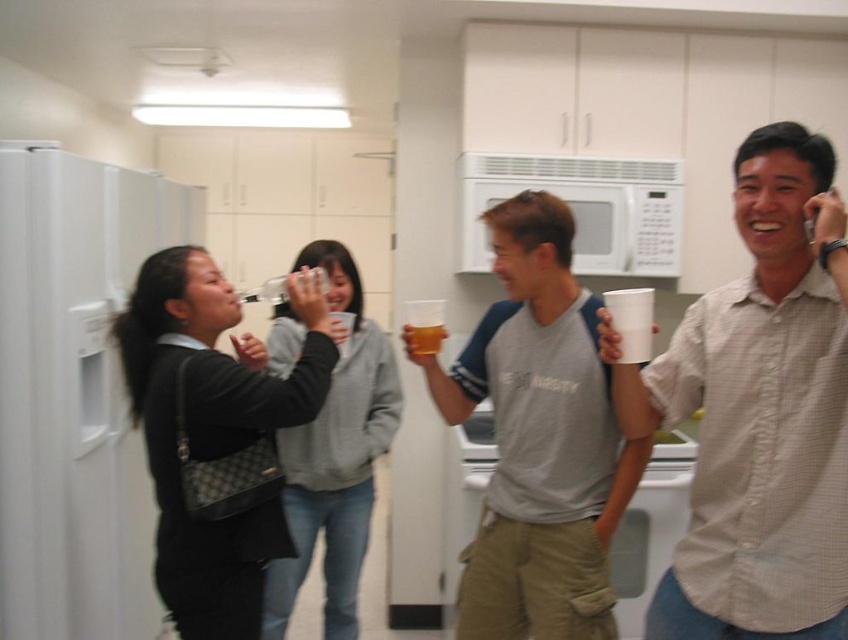
You are a photographer trying to capture a group photo of the people in the scene. You notice two individuals wearing the white shirt at right and the matte gray hoodie at center. Since you want to ensure both are fully visible in the frame, which clothing item should you adjust your camera angle to focus on first?

The white shirt at right is not as tall as the matte gray hoodie at center, so you should focus on the white shirt at right first to ensure it is fully visible in the frame.

You are a person standing in the kitchen scene. You need to grab the matte black purse at left and the matte gray hoodie at center. Which item should you reach for first if you want to pick up the one that is closer to your current position?

The matte gray hoodie at center is closer to your current position because the matte black purse at left is located above it, implying it is higher up but not necessarily closer in horizontal distance.

You are a delivery person who needs to place a large package on the counter. The package is bigger than the white shirt at right. Can you fit it on the counter next to the white matte microwave at upper center?

The white shirt at right is larger than the white matte microwave at upper center. Since the package is bigger than the white shirt at right, it might not fit next to the microwave. Check the counter space availability.